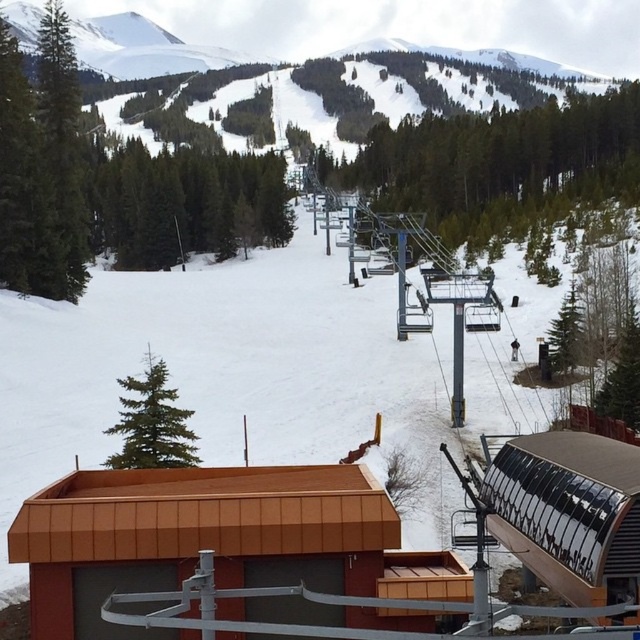
You are planning to take a photo of the brown corrugated metal ski resort at center and the green matte pine at upper left. Which object should you focus on first if you want to capture both in the same frame without moving the camera?

The brown corrugated metal ski resort at center has a lesser width compared to green matte pine at upper left, so you should focus on the green matte pine at upper left first to ensure it fits in the frame since it is wider.

You are standing at the brown corrugated metal ski resort at center and want to reach the green matte pine at upper left. Given that the distance between them is just under 10 meters, can you walk directly to the pine without any obstacles?

The distance between the brown corrugated metal ski resort at center and the green matte pine at upper left is 9.99 meters, so yes, you can walk directly to the pine without any obstacles as there is no mention of obstacles in the scene description.